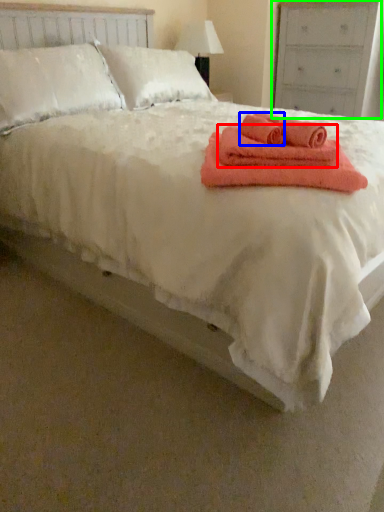
Question: Which object is the farthest from bath towel (highlighted by a red box)? Choose among these: bath towel (highlighted by a blue box) or dresser (highlighted by a green box).

Choices:
 (A) bath towel
 (B) dresser

Answer: (B)